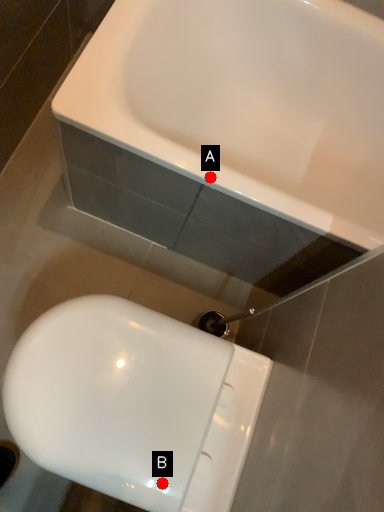
Question: Two points are circled on the image, labeled by A and B beside each circle. Which of the following is the closest to the observer?

Choices:
 (A) A is closer
 (B) B is closer

Answer: (B)